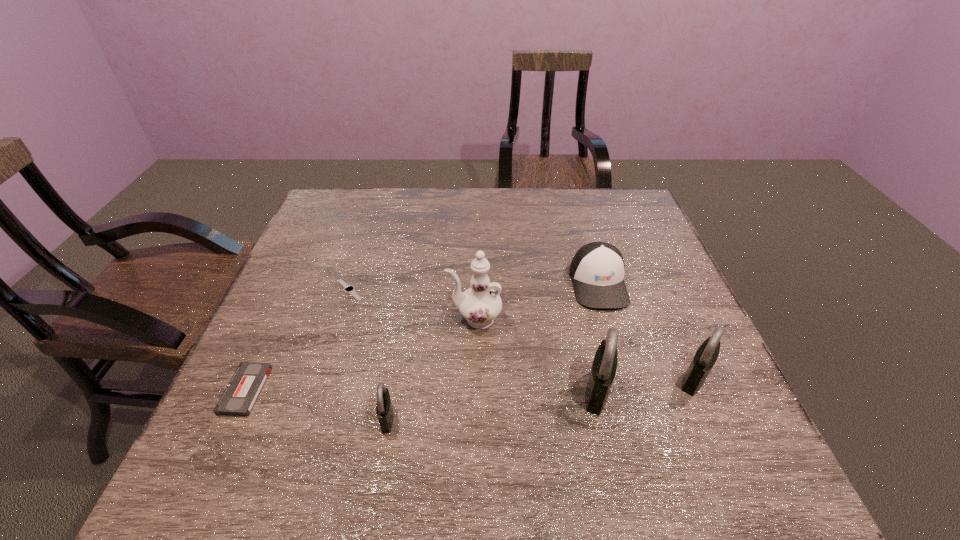
Locate an element on the screen. This screenshot has width=960, height=540. vacant space that satisfies the following two spatial constraints: 1. on the front panel of the cap; 2. on the left side of the third tallest object is located at coordinates (626, 379).

You are a GUI agent. You are given a task and a screenshot of the screen. Output one action in this format:
    pyautogui.click(x=<x>, y=<y>)
    Task: Click on the vacant space that satisfies the following two spatial constraints: 1. on the front panel of the cap; 2. on the right side of the third tallest object
    The image size is (960, 540).
    Given the screenshot: What is the action you would take?
    pyautogui.click(x=626, y=379)

This screenshot has width=960, height=540. Identify the location of free space in the image that satisfies the following two spatial constraints: 1. on the front panel of the cap; 2. at the spout of the fourth object from right to left. (609, 319).

Identify the location of vacant space that satisfies the following two spatial constraints: 1. on the front panel of the cap; 2. on the left side of the second tallest padlock. (626, 379).